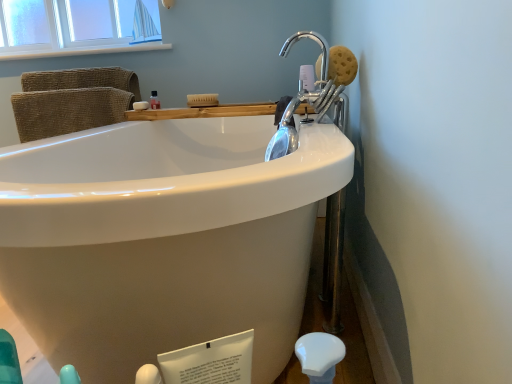
Question: Should I look upward or downward to see brown sponge at upper right, positioned as the 1th soap in front-to-back order?

Choices:
 (A) up
 (B) down

Answer: (A)

Question: Is wooden tray at upper center taller than brown sponge at upper right, the 1th soap viewed from the right?

Choices:
 (A) no
 (B) yes

Answer: (A)

Question: Can you confirm if wooden tray at upper center is smaller than brown sponge at upper right, positioned as the second soap in back-to-front order?

Choices:
 (A) no
 (B) yes

Answer: (A)

Question: Is there a large distance between wooden tray at upper center and brown sponge at upper right, the second soap positioned from the left?

Choices:
 (A) yes
 (B) no

Answer: (B)

Question: From the image's perspective, is wooden tray at upper center located above brown sponge at upper right, the 1th soap viewed from the right?

Choices:
 (A) no
 (B) yes

Answer: (A)

Question: Would you say wooden tray at upper center contains brown sponge at upper right, positioned as the 1th soap in front-to-back order?

Choices:
 (A) yes
 (B) no

Answer: (B)

Question: Is wooden tray at upper center oriented away from brown sponge at upper right, positioned as the 1th soap in front-to-back order?

Choices:
 (A) yes
 (B) no

Answer: (B)

Question: Could you tell me if wooden tray at upper center is facing white wood window sill at upper left?

Choices:
 (A) no
 (B) yes

Answer: (A)

Question: Is wooden tray at upper center to the right of white wood window sill at upper left from the viewer's perspective?

Choices:
 (A) no
 (B) yes

Answer: (B)

Question: Can you confirm if wooden tray at upper center is wider than white wood window sill at upper left?

Choices:
 (A) yes
 (B) no

Answer: (A)

Question: From a real-world perspective, does wooden tray at upper center stand above white wood window sill at upper left?

Choices:
 (A) no
 (B) yes

Answer: (A)

Question: From the image's perspective, is wooden tray at upper center located beneath white wood window sill at upper left?

Choices:
 (A) no
 (B) yes

Answer: (B)

Question: From the image's perspective, is wooden tray at upper center over white wood window sill at upper left?

Choices:
 (A) yes
 (B) no

Answer: (B)

Question: From a real-world perspective, does wooden tray at upper center stand above translucent plastic bottle at upper center?

Choices:
 (A) yes
 (B) no

Answer: (B)